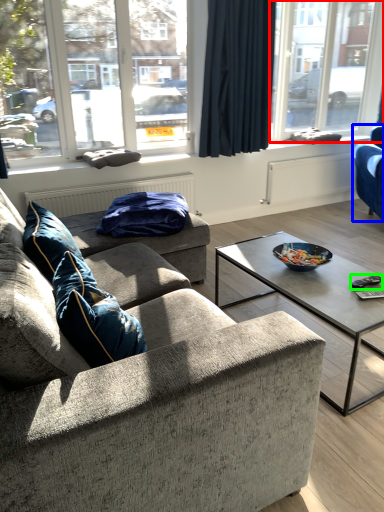
Question: Which object is the closest to the window (highlighted by a red box)? Choose among these: studio couch (highlighted by a blue box) or remote (highlighted by a green box).

Choices:
 (A) studio couch
 (B) remote

Answer: (A)